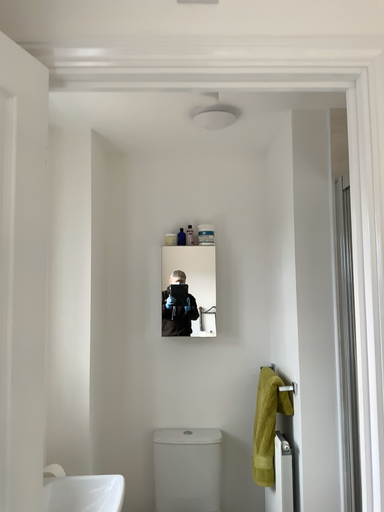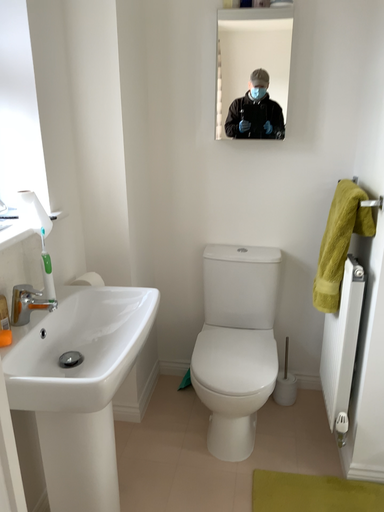
Question: How did the camera likely rotate when shooting the video?

Choices:
 (A) rotated downward
 (B) rotated upward

Answer: (A)